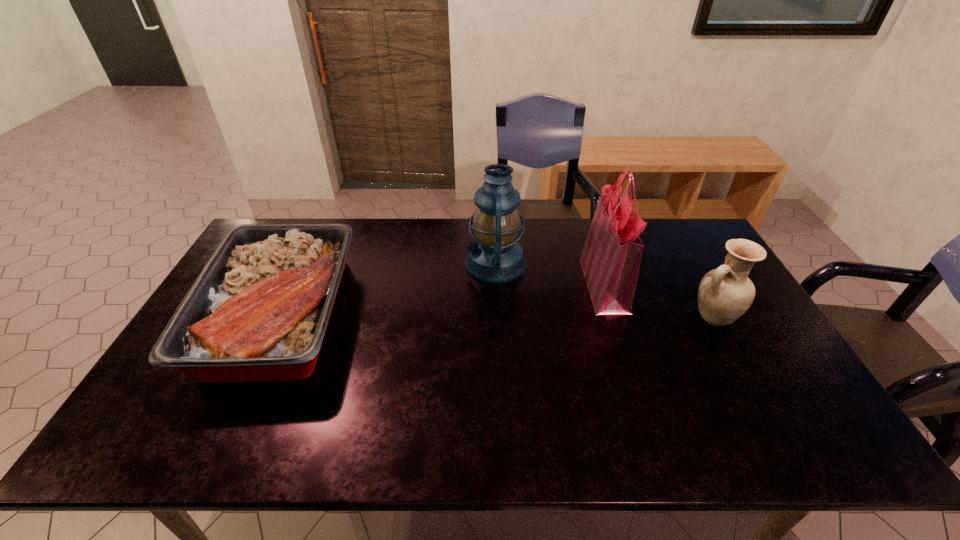
This screenshot has width=960, height=540. In the image, there is a desktop. Identify the location of free space at the near left corner. (159, 431).

Locate an element on the screen. This screenshot has width=960, height=540. vacant space at the far right corner is located at coordinates (660, 223).

The image size is (960, 540). In order to click on free spot between the leftmost object and the rightmost object in this screenshot , I will do `click(496, 315)`.

Find the location of a particular element. The width and height of the screenshot is (960, 540). free space between the second object from right to left and the pottery is located at coordinates (659, 300).

You are a GUI agent. You are given a task and a screenshot of the screen. Output one action in this format:
    pyautogui.click(x=<x>, y=<y>)
    Task: Click on the free space between the second object from left to right and the tray
    The width and height of the screenshot is (960, 540).
    Given the screenshot: What is the action you would take?
    pyautogui.click(x=388, y=289)

The height and width of the screenshot is (540, 960). Identify the location of free spot between the shortest object and the lantern. (388, 289).

In order to click on vacant area between the shortest object and the second object from right to left in this screenshot , I will do `click(442, 299)`.

At what (x,y) coordinates should I click in order to perform the action: click on empty space that is in between the lantern and the tray. Please return your answer as a coordinate pair (x, y). This screenshot has height=540, width=960. Looking at the image, I should click on (388, 289).

Identify the location of free space between the lantern and the shortest object. This screenshot has height=540, width=960. (388, 289).

Locate which object ranks second in proximity to the lantern. Please provide its 2D coordinates. Your answer should be formatted as a tuple, i.e. [(x, y)], where the tuple contains the x and y coordinates of a point satisfying the conditions above.

[(258, 311)]